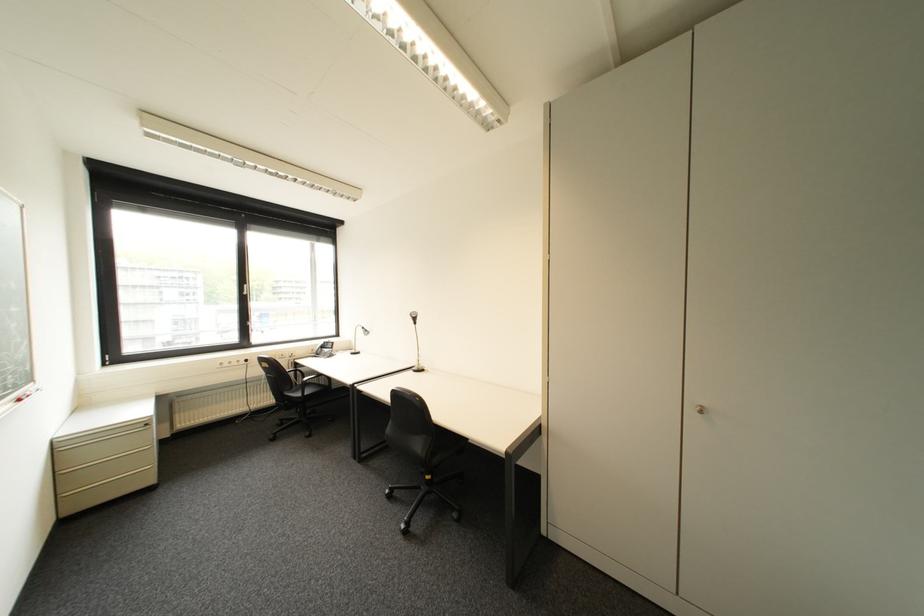
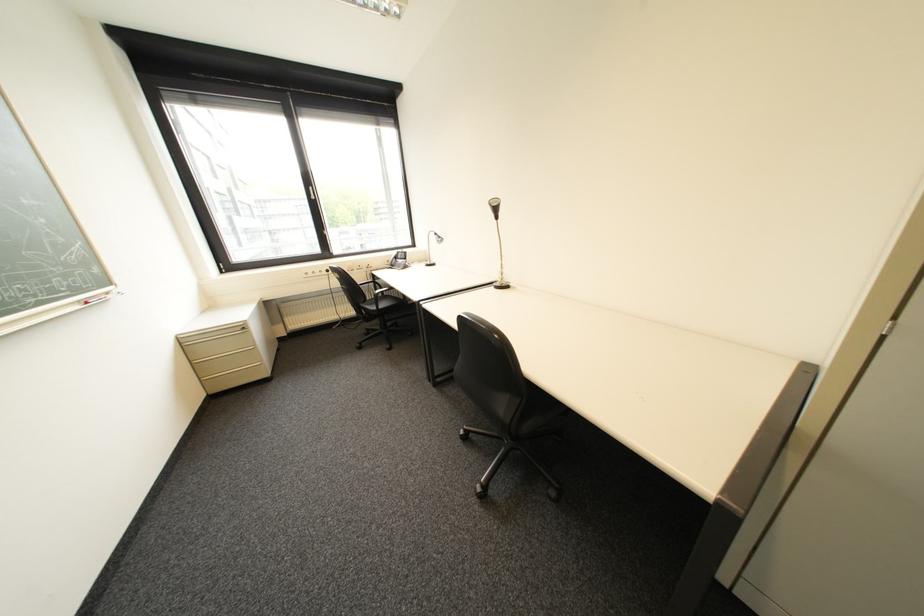
Question: In a continuous first-person perspective shot, in which direction is the camera moving?

Choices:
 (A) Left
 (B) Right
 (C) Forward
 (D) Backward

Answer: (C)